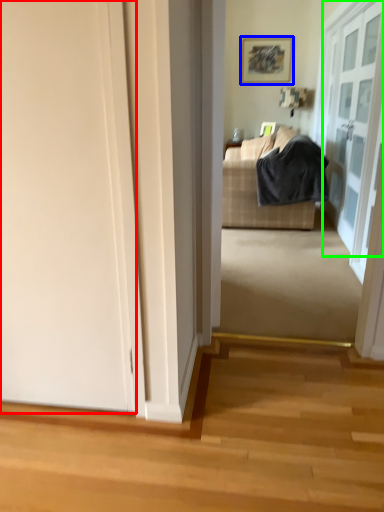
Question: Estimate the real-world distances between objects in this image. Which object is closer to door (highlighted by a red box), picture frame (highlighted by a blue box) or door (highlighted by a green box)?

Choices:
 (A) picture frame
 (B) door

Answer: (B)